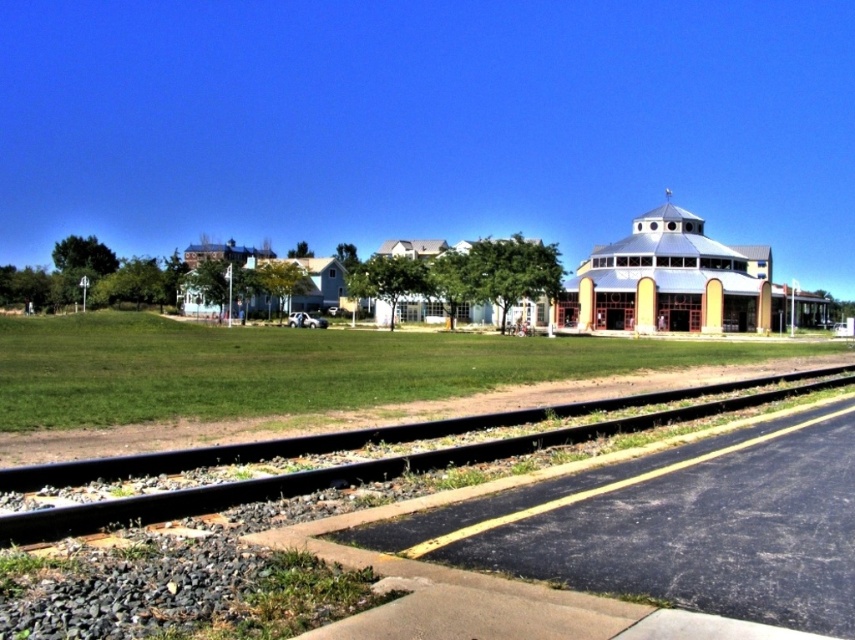
Question: Among these points, which one is nearest to the camera?

Choices:
 (A) (699, 323)
 (B) (688, 396)

Answer: (B)

Question: Does metallic blue dome at center appear on the right side of black metal train track at lower center?

Choices:
 (A) no
 (B) yes

Answer: (B)

Question: Is metallic blue dome at center in front of black metal train track at lower center?

Choices:
 (A) no
 (B) yes

Answer: (A)

Question: Does metallic blue dome at center appear over black metal train track at lower center?

Choices:
 (A) yes
 (B) no

Answer: (A)

Question: Which point appears closest to the camera in this image?

Choices:
 (A) (665, 412)
 (B) (659, 300)

Answer: (A)